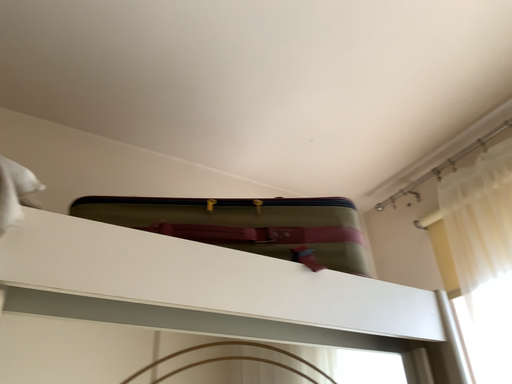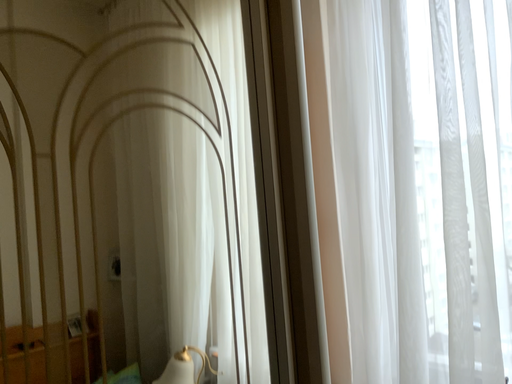
Question: How did the camera likely rotate when shooting the video?

Choices:
 (A) rotated downward
 (B) rotated upward

Answer: (A)